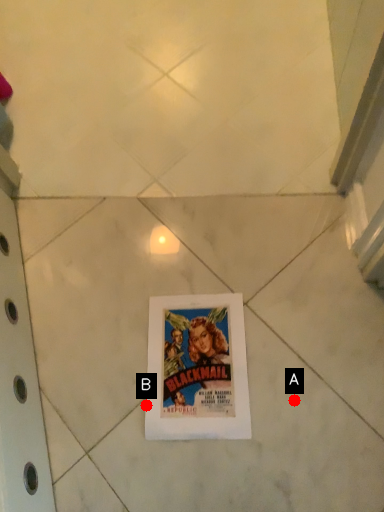
Question: Two points are circled on the image, labeled by A and B beside each circle. Which point is closer to the camera?

Choices:
 (A) A is closer
 (B) B is closer

Answer: (A)